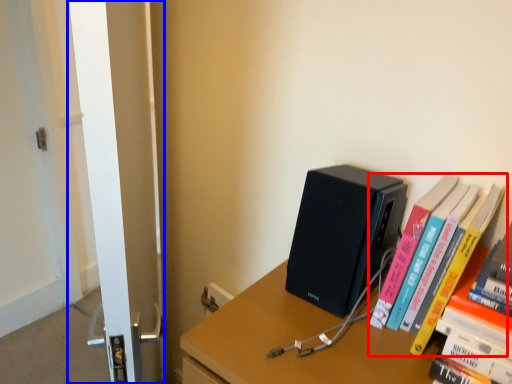
Question: Among these objects, which one is nearest to the camera, book (highlighted by a red box) or screen door (highlighted by a blue box)?

Choices:
 (A) book
 (B) screen door

Answer: (B)